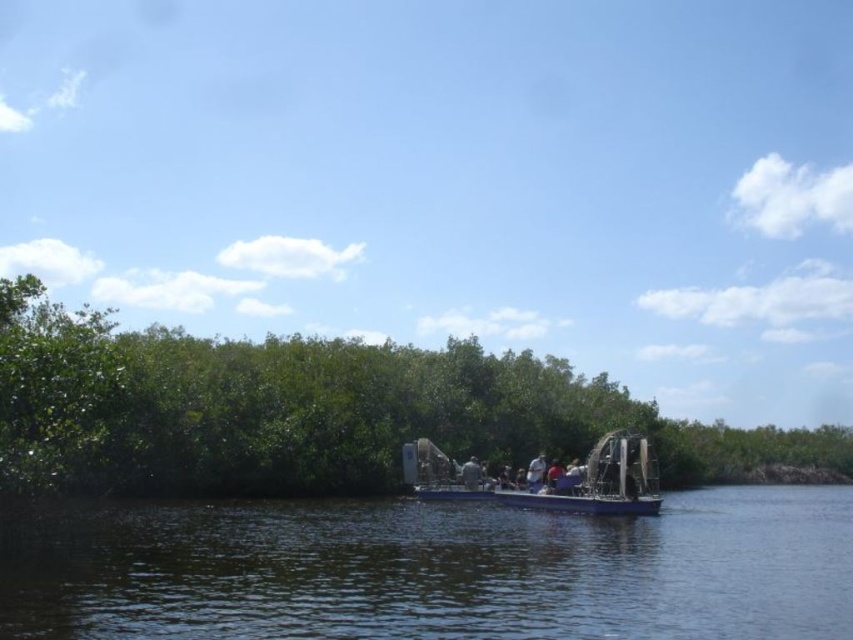
You are a tourist on the boat and want to take a photo of the green leafy trees at center without the dark blue water at center in the frame. Is it possible to angle your camera to exclude the water?

The dark blue water at center is positioned over green leafy trees at center, so angling the camera might not exclude the water as it is covering the trees in the center. You might need to adjust your position or use a different angle where the water isn

You are a tour guide on a small motorized boat in the waterway. You need to navigate between the dark blue water at center and the green leafy trees at center. What is the minimum width your boat must have to pass through this space?

The distance between the dark blue water at center and the green leafy trees at center is 18.05 meters. Therefore, the boat must be at least 18.05 meters wide to pass through this space.

You are a drone operator trying to capture a photo of the green leafy trees at center from above. What are the coordinates you should aim for?

The coordinates for the green leafy trees at center are at point (315, 410).